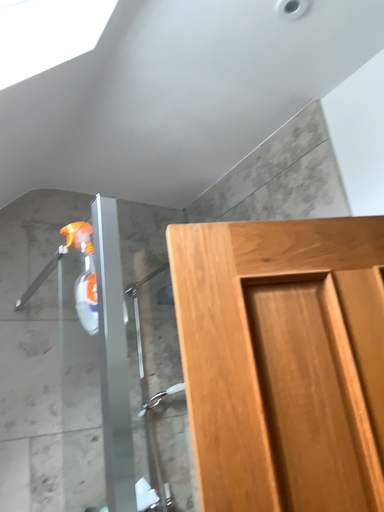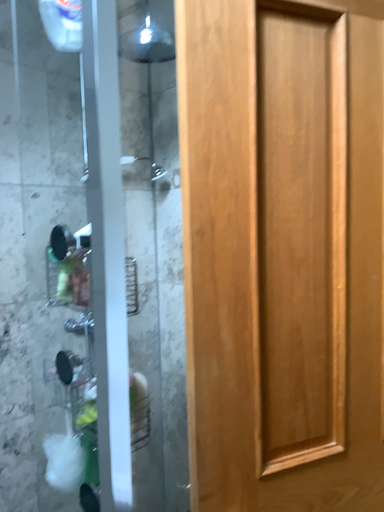
Question: Which way did the camera rotate in the video?

Choices:
 (A) rotated upward
 (B) rotated downward

Answer: (B)